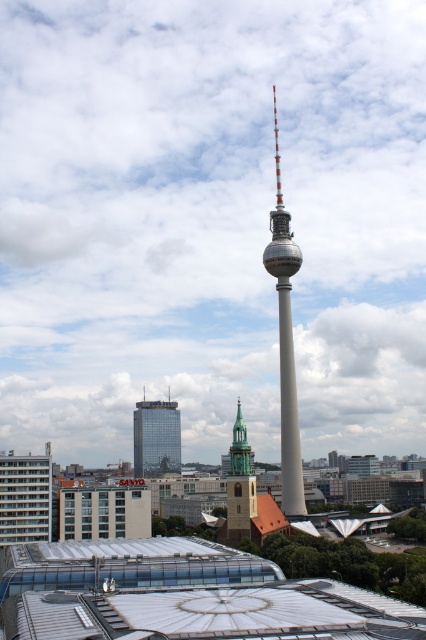
Between point (149, 454) and point (227, 529), which one is positioned in front?

Point (227, 529)

Which of these two, glassy reflective skyscraper at center or green stone church steeple at center, stands shorter?

green stone church steeple at center is shorter.

Is point (166, 426) farther from viewer compared to point (232, 484)?

Yes, point (166, 426) is behind point (232, 484).

The width and height of the screenshot is (426, 640). Identify the location of glassy reflective skyscraper at center. (155, 438).

The width and height of the screenshot is (426, 640). What do you see at coordinates (213, 612) in the screenshot? I see `white textured roof at lower center` at bounding box center [213, 612].

Is point (77, 593) positioned after point (180, 465)?

That is False.

The width and height of the screenshot is (426, 640). Identify the location of white textured roof at lower center. (213, 612).

Where is `white textured roof at lower center`? This screenshot has width=426, height=640. white textured roof at lower center is located at coordinates (213, 612).

Can you confirm if smooth gray tower at center is shorter than green stone church steeple at center?

No.

Does point (270, 212) come in front of point (227, 534)?

No.

The height and width of the screenshot is (640, 426). Find the location of `smooth gray tower at center`. smooth gray tower at center is located at coordinates (285, 342).